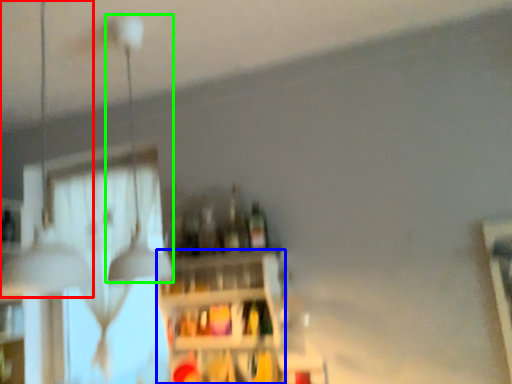
Question: Estimate the real-world distances between objects in this image. Which object is closer to lamp (highlighted by a red box), shelf (highlighted by a blue box) or lamp (highlighted by a green box)?

Choices:
 (A) shelf
 (B) lamp

Answer: (A)